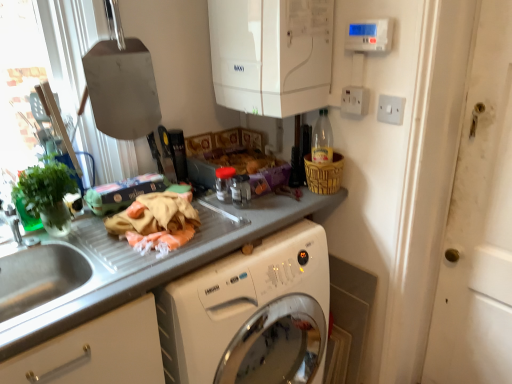
Question: Is green matte plant at left thinner than white glossy boiler at upper center, which appears as the third appliance when viewed from the left?

Choices:
 (A) no
 (B) yes

Answer: (B)

Question: From the image's perspective, does green matte plant at left appear higher than white glossy boiler at upper center, which appears as the third appliance when viewed from the left?

Choices:
 (A) yes
 (B) no

Answer: (B)

Question: Does green matte plant at left have a greater height compared to white glossy boiler at upper center, the 1th appliance in the right-to-left sequence?

Choices:
 (A) yes
 (B) no

Answer: (B)

Question: Does green matte plant at left have a larger size compared to white glossy boiler at upper center, the 1th appliance in the right-to-left sequence?

Choices:
 (A) yes
 (B) no

Answer: (B)

Question: Can white glossy boiler at upper center, which appears as the third appliance when viewed from the left, be found inside green matte plant at left?

Choices:
 (A) no
 (B) yes

Answer: (A)

Question: Is green matte plant at left far from white glossy boiler at upper center, the 1th appliance in the right-to-left sequence?

Choices:
 (A) yes
 (B) no

Answer: (B)

Question: From the image's perspective, would you say woven brown basket at upper right is positioned over white plastic electric outlet at upper right, positioned as the 2th electric outlet in right-to-left order?

Choices:
 (A) yes
 (B) no

Answer: (B)

Question: Can we say woven brown basket at upper right lies outside white plastic electric outlet at upper right, positioned as the 2th electric outlet in right-to-left order?

Choices:
 (A) yes
 (B) no

Answer: (A)

Question: Is the depth of woven brown basket at upper right greater than that of white plastic electric outlet at upper right, the 1th electric outlet viewed from the left?

Choices:
 (A) yes
 (B) no

Answer: (A)

Question: Considering the relative sizes of woven brown basket at upper right and white plastic electric outlet at upper right, positioned as the 2th electric outlet in right-to-left order, in the image provided, is woven brown basket at upper right smaller than white plastic electric outlet at upper right, positioned as the 2th electric outlet in right-to-left order,?

Choices:
 (A) yes
 (B) no

Answer: (B)

Question: Considering the relative positions of woven brown basket at upper right and white plastic electric outlet at upper right, the 1th electric outlet viewed from the left, in the image provided, is woven brown basket at upper right in front of white plastic electric outlet at upper right, the 1th electric outlet viewed from the left,?

Choices:
 (A) yes
 (B) no

Answer: (B)

Question: Is woven brown basket at upper right touching white plastic electric outlet at upper right, positioned as the 2th electric outlet in right-to-left order?

Choices:
 (A) no
 (B) yes

Answer: (A)

Question: Considering the relative sizes of green matte plant at left and smooth gray countertop at center in the image provided, is green matte plant at left shorter than smooth gray countertop at center?

Choices:
 (A) yes
 (B) no

Answer: (A)